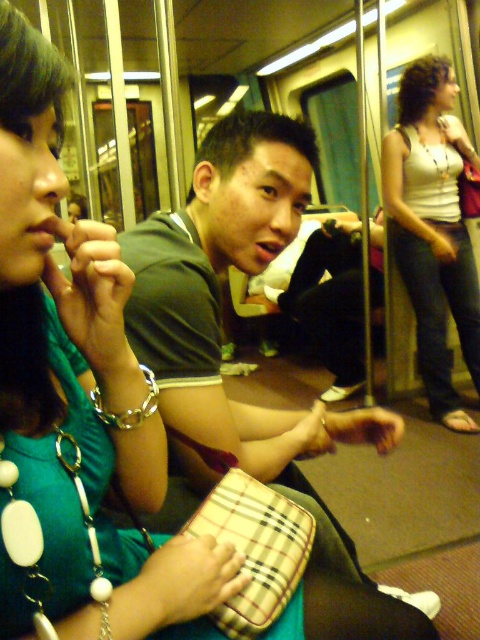
Can you confirm if green matte shirt at center is wider than white tank top at right?

Correct, the width of green matte shirt at center exceeds that of white tank top at right.

Between green matte shirt at center and white tank top at right, which one is positioned higher?

white tank top at right is above.

Between point (135, 244) and point (422, 152), which one is positioned behind?

The point (422, 152) is behind.

Find the location of a particular element. green matte shirt at center is located at coordinates (218, 301).